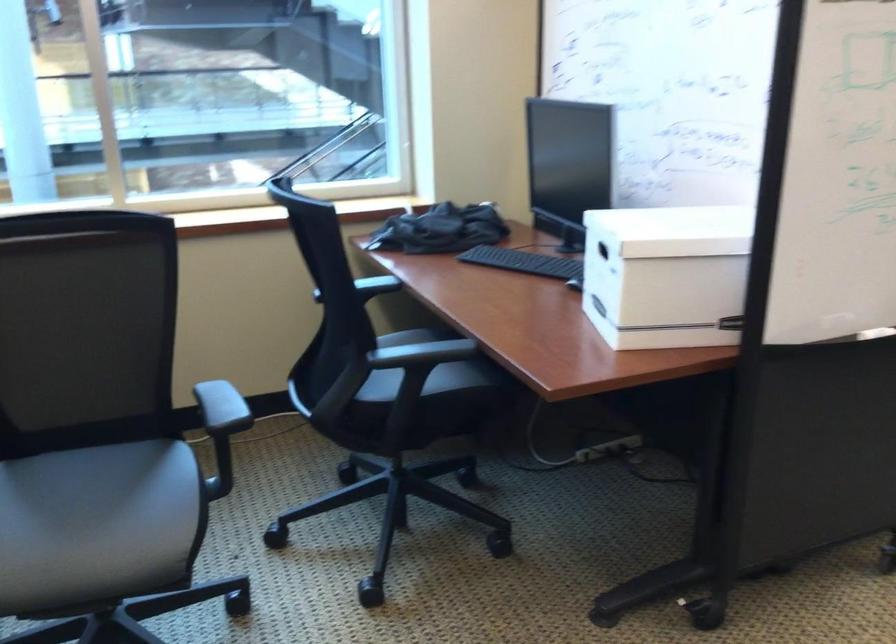
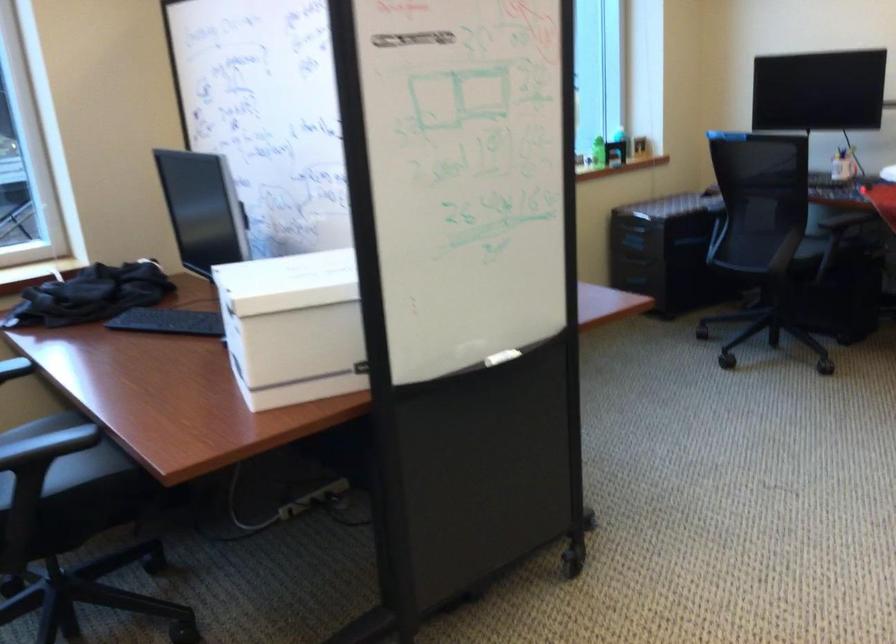
The point at (433, 357) is marked in the first image. Where is the corresponding point in the second image?

(47, 446)